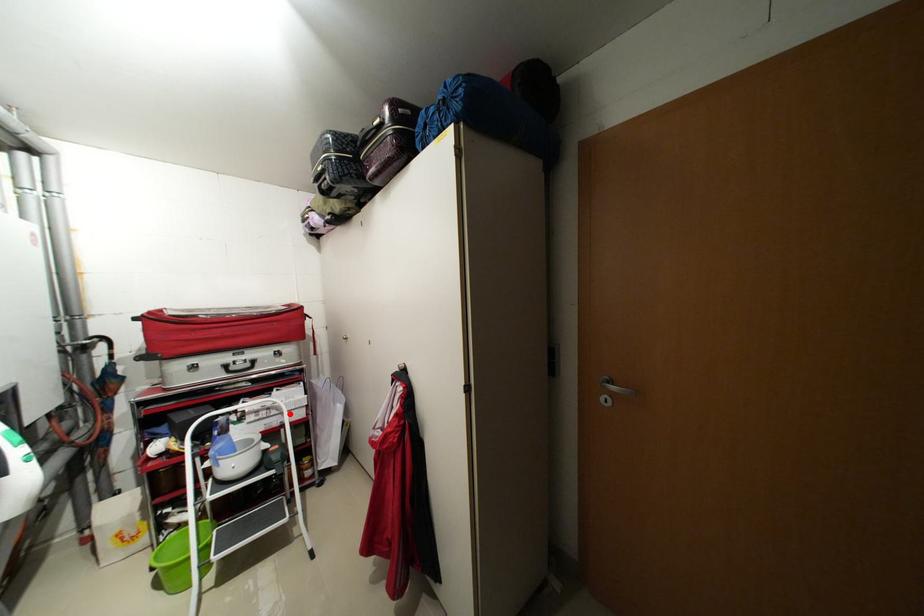
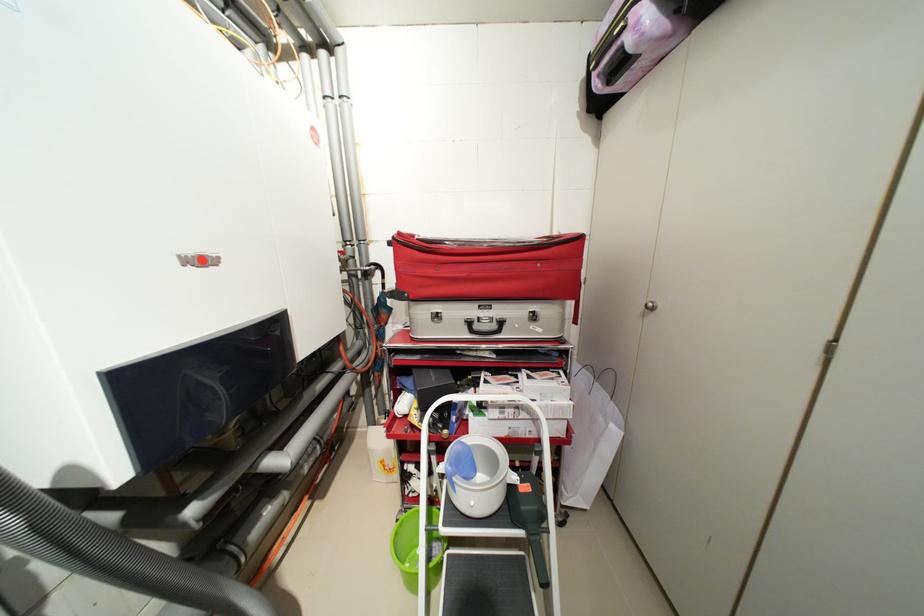
The point at the highlighted location is marked in the first image. Where is the corresponding point in the second image?

(541, 421)